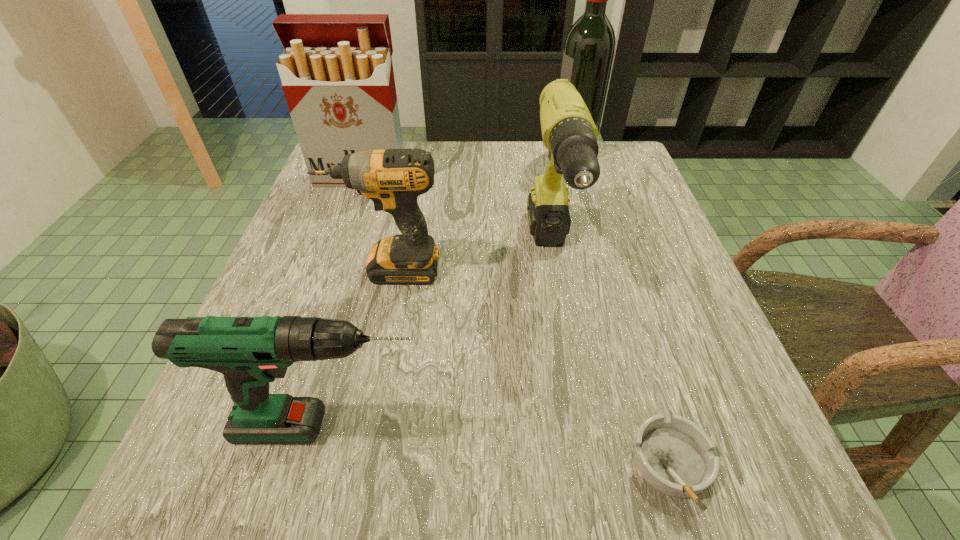
Identify which drill is the third nearest to the farthest object. Please provide its 2D coordinates. Your answer should be formatted as a tuple, i.e. [(x, y)], where the tuple contains the x and y coordinates of a point satisfying the conditions above.

[(250, 352)]

Identify the location of drill that is the second closest to the fourth object from left to right. The height and width of the screenshot is (540, 960). coord(250,352).

Identify the location of vacant space that satisfies the following two spatial constraints: 1. on the label of the farthest object; 2. with the lid open on the cigarette case. The height and width of the screenshot is (540, 960). [580, 177].

This screenshot has height=540, width=960. Find the location of `free space that satisfies the following two spatial constraints: 1. on the label of the wine bottle; 2. on the left side of the shortest object`. free space that satisfies the following two spatial constraints: 1. on the label of the wine bottle; 2. on the left side of the shortest object is located at coordinates (663, 464).

Where is `free space that satisfies the following two spatial constraints: 1. on the handle side of the nearest drill; 2. on the back side of the shortest object`? free space that satisfies the following two spatial constraints: 1. on the handle side of the nearest drill; 2. on the back side of the shortest object is located at coordinates (322, 464).

At what (x,y) coordinates should I click in order to perform the action: click on vacant region that satisfies the following two spatial constraints: 1. on the label of the farthest object; 2. on the left side of the shortest object. Please return your answer as a coordinate pair (x, y). Looking at the image, I should click on (663, 464).